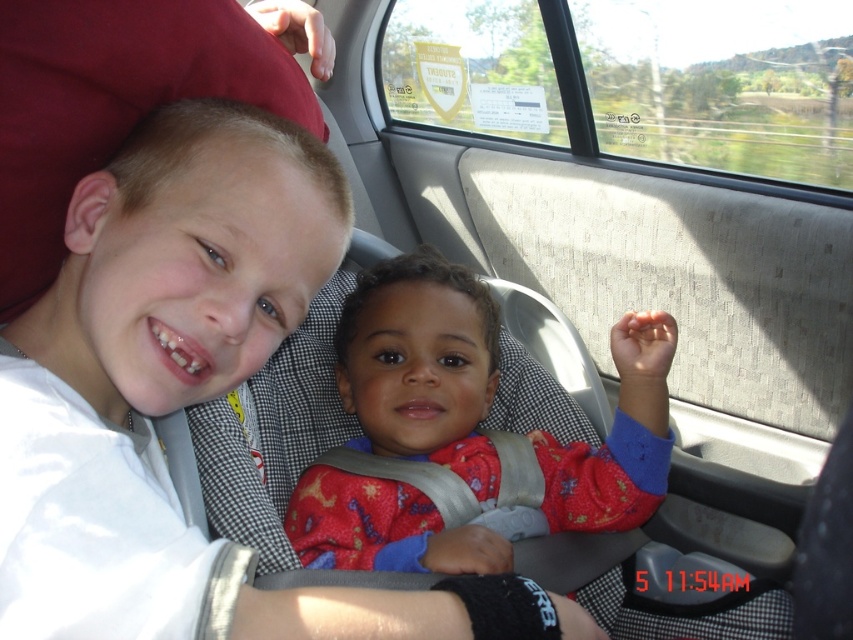
You are a safety inspector checking seatbelt placements in a car. You observe the red fabric baby car seat at center and the matte white shirt at upper left. Which object is closer to you, the inspector?

The red fabric baby car seat at center is closer to you than the matte white shirt at upper left because it is further to the viewer.

You are a photographer trying to capture a clear photo of both children in the car. You notice two points marked in the image at coordinates point (463, 477) and point (73, 10). Which point should you focus on to ensure the foreground child is in focus?

Point (463, 477) is further to the camera than point (73, 10), so focusing on point (463, 477) will ensure the foreground child is in focus.